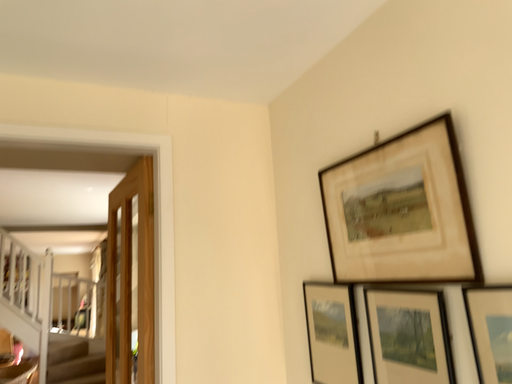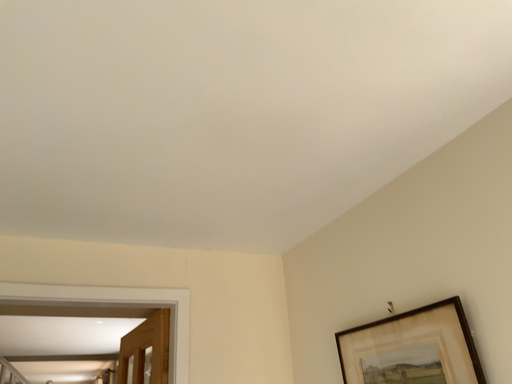
Question: Which way did the camera rotate in the video?

Choices:
 (A) rotated upward
 (B) rotated downward

Answer: (A)